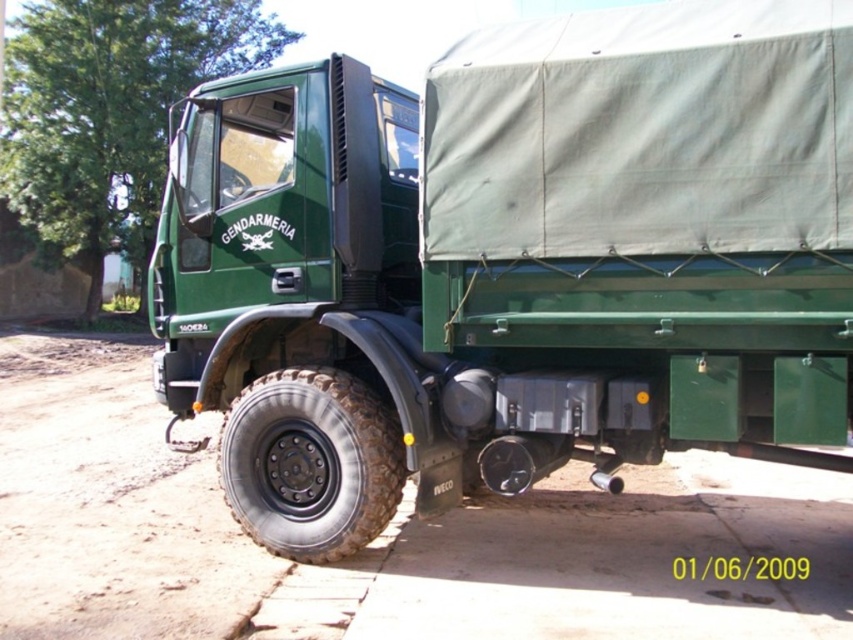
Question: Estimate the real-world distances between objects in this image. Which object is closer to the black rubber tire at lower left?

Choices:
 (A) brown dirt track at lower left
 (B) green matte truck at center

Answer: (B)

Question: Is brown dirt track at lower left in front of black rubber tire at lower left?

Choices:
 (A) no
 (B) yes

Answer: (B)

Question: Can you confirm if brown dirt track at lower left is bigger than black rubber tire at lower left?

Choices:
 (A) yes
 (B) no

Answer: (A)

Question: Is green matte truck at center smaller than black rubber tire at lower left?

Choices:
 (A) no
 (B) yes

Answer: (A)

Question: Which is farther from the green matte truck at center?

Choices:
 (A) black rubber tire at lower left
 (B) brown dirt track at lower left

Answer: (B)

Question: Which of the following is the farthest from the observer?

Choices:
 (A) green matte truck at center
 (B) black rubber tire at lower left
 (C) brown dirt track at lower left

Answer: (B)